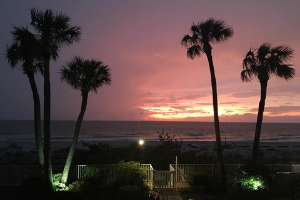
You are a GUI agent. You are given a task and a screenshot of the screen. Output one action in this format:
    pyautogui.click(x=<x>, y=<y>)
    Task: Click on the benches
    The height and width of the screenshot is (200, 300).
    Given the screenshot: What is the action you would take?
    pyautogui.click(x=282, y=147)